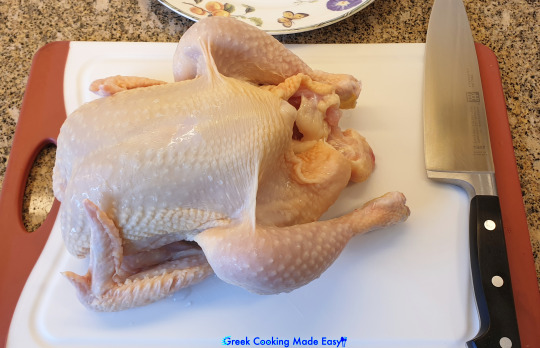
At what (x,y) coordinates should I click in order to perform the action: click on knife handle. Please return your answer as a coordinate pair (x, y). Looking at the image, I should click on (484, 253).